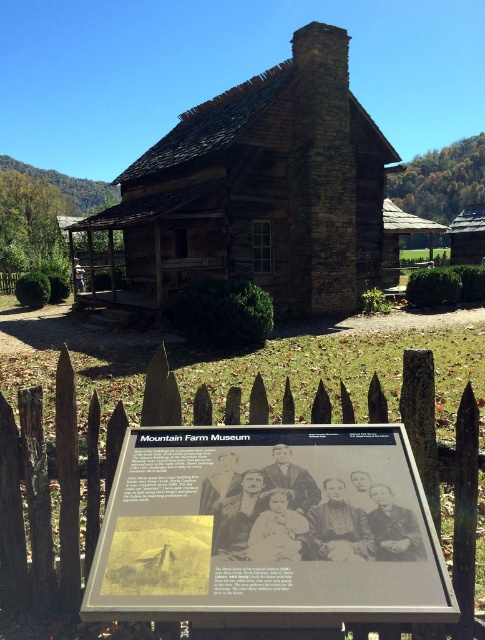
Can you confirm if rustic wood cabin at center is taller than brown wooden picket fence at lower left?

Yes.

Is rustic wood cabin at center above brown wooden picket fence at lower left?

Yes.

Is point (342, 92) positioned behind point (420, 452)?

Yes, it is.

I want to click on rustic wood cabin at center, so click(x=258, y=189).